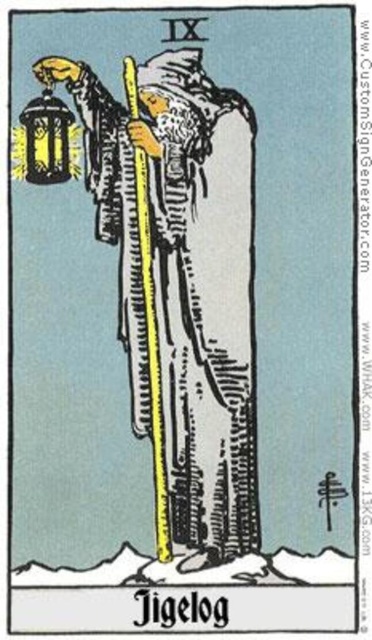
Which is more to the left, white textured robe at center or yellow wood pole at center?

From the viewer's perspective, yellow wood pole at center appears more on the left side.

Is white textured robe at center wider than yellow wood pole at center?

Yes, white textured robe at center is wider than yellow wood pole at center.

Who is more forward, (98, 118) or (126, 81)?

Point (126, 81) is in front.

Image resolution: width=372 pixels, height=640 pixels. What are the coordinates of `white textured robe at center` in the screenshot? It's located at (186, 284).

Which of these two, yellow wood pole at center or metallic lantern at left, stands shorter?

metallic lantern at left

Does yellow wood pole at center appear on the right side of metallic lantern at left?

Yes, yellow wood pole at center is to the right of metallic lantern at left.

Identify the location of yellow wood pole at center. This screenshot has width=372, height=640. (152, 356).

Who is positioned more to the right, white textured robe at center or metallic lantern at left?

white textured robe at center

Is white textured robe at center shorter than metallic lantern at left?

No, white textured robe at center is not shorter than metallic lantern at left.

Is point (174, 468) behind point (40, 109)?

That is True.

The width and height of the screenshot is (372, 640). Find the location of `white textured robe at center`. white textured robe at center is located at coordinates (186, 284).